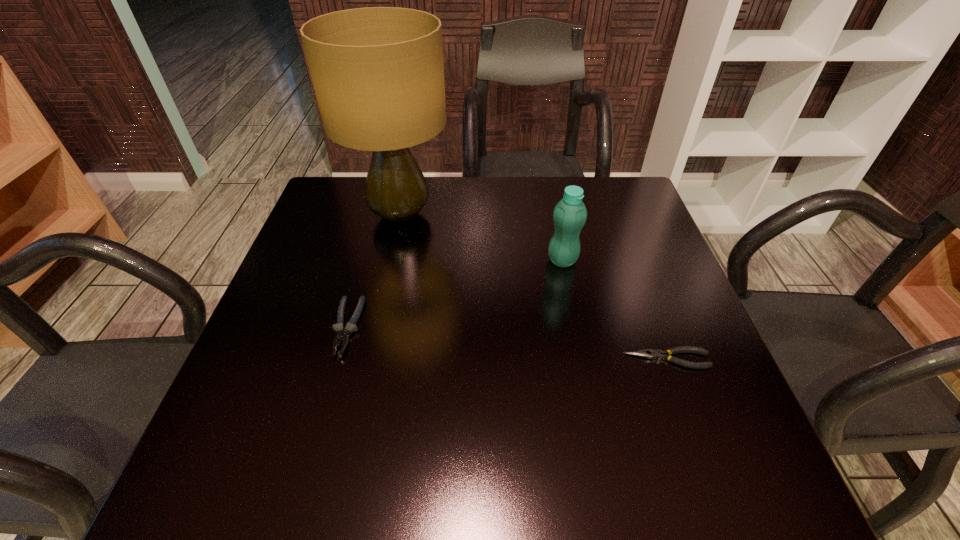
The image size is (960, 540). Find the location of `free space that is in between the tallest object and the water bottle`. free space that is in between the tallest object and the water bottle is located at coordinates (481, 238).

Where is `free space between the shortest object and the left pliers`? free space between the shortest object and the left pliers is located at coordinates (507, 343).

Locate an element on the screen. This screenshot has width=960, height=540. empty space between the water bottle and the lampshade is located at coordinates (481, 238).

Locate which object is the third closest to the shorter pliers. Please provide its 2D coordinates. Your answer should be formatted as a tuple, i.e. [(x, y)], where the tuple contains the x and y coordinates of a point satisfying the conditions above.

[(342, 335)]

Select which object appears as the closest to the rightmost object. Please provide its 2D coordinates. Your answer should be formatted as a tuple, i.e. [(x, y)], where the tuple contains the x and y coordinates of a point satisfying the conditions above.

[(569, 216)]

Locate an element on the screen. free space in the image that satisfies the following two spatial constraints: 1. at the front cap of the shorter pliers; 2. on the left side of the third object from left to right is located at coordinates [x=582, y=359].

Identify the location of vacant space that satisfies the following two spatial constraints: 1. at the gripping part of the second shortest object; 2. on the left side of the right pliers. (338, 359).

Find the location of a particular element. free space that satisfies the following two spatial constraints: 1. at the gripping part of the second shortest object; 2. on the right side of the rightmost object is located at coordinates (338, 359).

I want to click on vacant space that satisfies the following two spatial constraints: 1. at the front cap of the rightmost object; 2. on the right side of the second object from right to left, so click(582, 359).

You are a GUI agent. You are given a task and a screenshot of the screen. Output one action in this format:
    pyautogui.click(x=<x>, y=<y>)
    Task: Click on the vacant space that satisfies the following two spatial constraints: 1. at the front cap of the shortest object; 2. on the right side of the water bottle
    This screenshot has height=540, width=960.
    Given the screenshot: What is the action you would take?
    pyautogui.click(x=582, y=359)